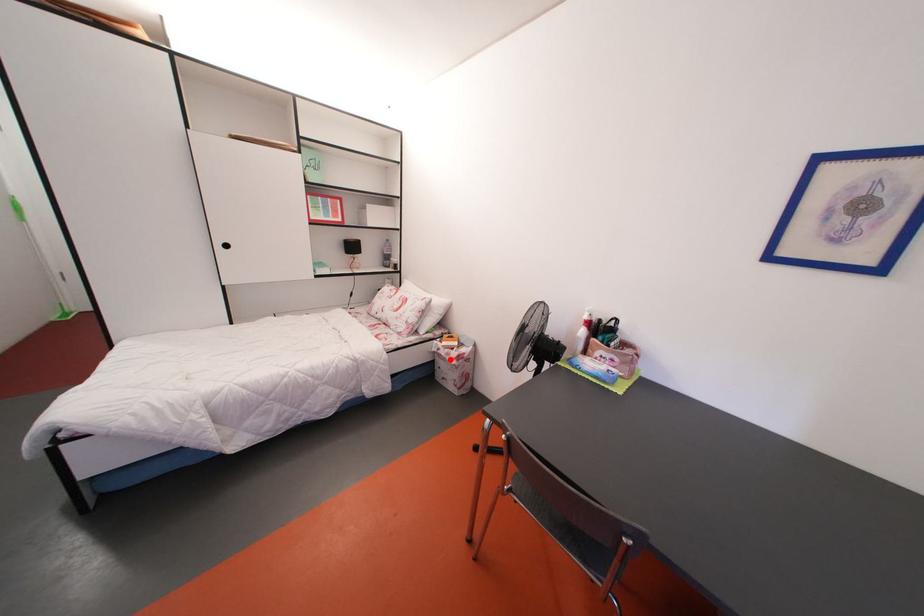
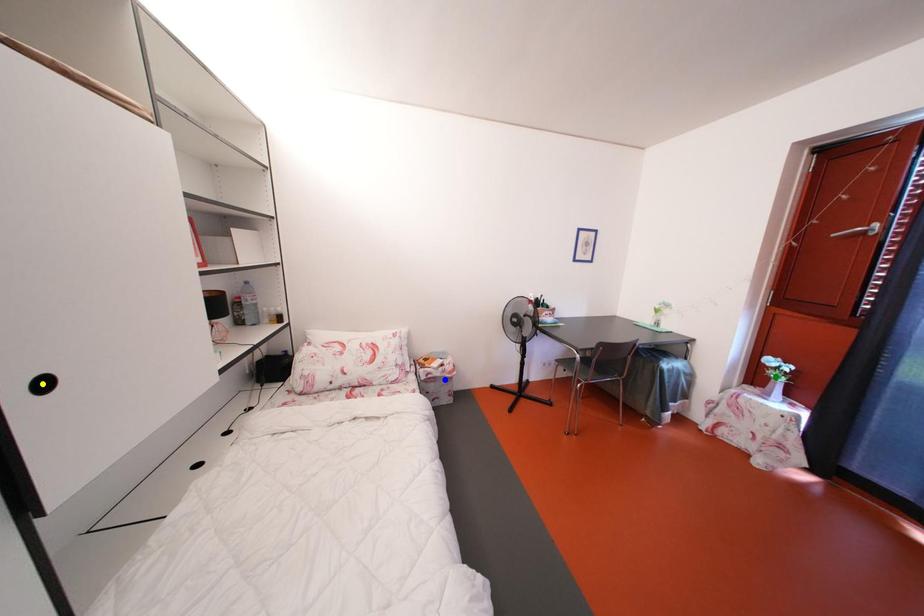
Question: I am providing you with two images of the same scene from different viewpoints. A red point is marked on the first image. You are given multiple points on the second image. Which point in image 2 is actually the same real-world point as the red point in image 1?

Choices:
 (A) blue point
 (B) green point
 (C) yellow point

Answer: (A)